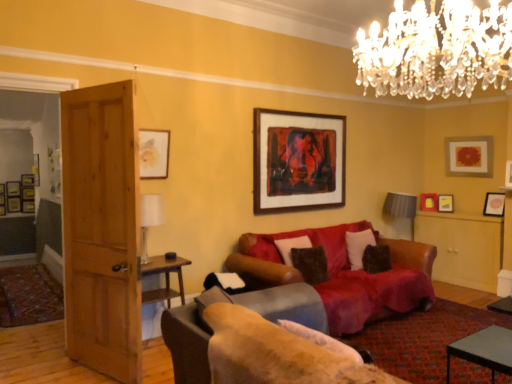
This screenshot has height=384, width=512. What are the coordinates of `vacant space in front of matte yellow picture frame at upper right, placed as the fifth picture frame when sorted from front to back` in the screenshot? It's located at (452, 210).